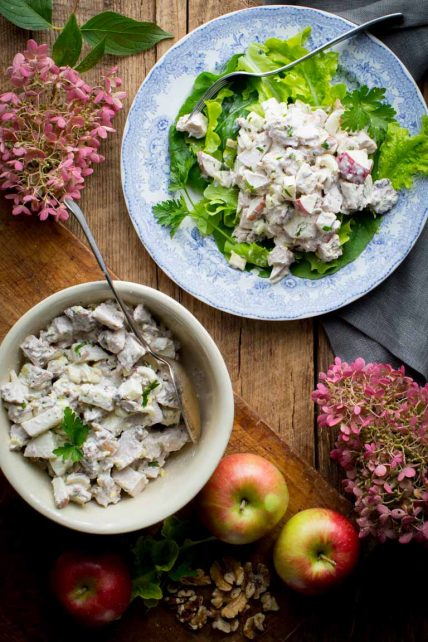
I want to click on plate, so pos(182,71).